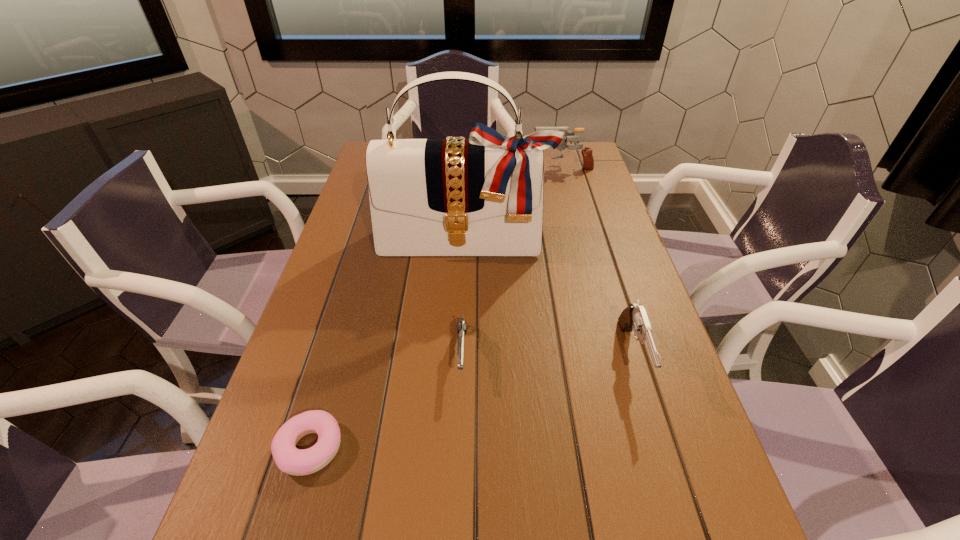
Locate an element on the screen. vacant space located 0.320m at the barrel end of the farthest object is located at coordinates (439, 166).

This screenshot has width=960, height=540. I want to click on vacant space located 0.170m at the barrel end of the farthest object, so click(483, 166).

The image size is (960, 540). I want to click on vacant region located at the barrel end of the farthest object, so click(433, 166).

Find the location of a particular element. Image resolution: width=960 pixels, height=540 pixels. vacant position located 0.220m at the muzzle of the second shortest gun is located at coordinates (684, 522).

This screenshot has width=960, height=540. Identify the location of free region located aiming along the barrel of the second shortest object. (460, 420).

You are a GUI agent. You are given a task and a screenshot of the screen. Output one action in this format:
    pyautogui.click(x=<x>, y=<y>)
    Task: Click on the vacant area situated on the back of the shortest object
    The image size is (960, 540).
    Given the screenshot: What is the action you would take?
    pyautogui.click(x=343, y=335)

Where is `object that is at the far edge`? object that is at the far edge is located at coordinates (588, 162).

The image size is (960, 540). In order to click on satchel that is positioned at the left edge in this screenshot , I will do 483,196.

At what (x,y) coordinates should I click in order to perform the action: click on pastry at the left edge. Please return your answer as a coordinate pair (x, y). This screenshot has height=540, width=960. Looking at the image, I should click on (289, 459).

The image size is (960, 540). In order to click on object positioned at the far right corner in this screenshot , I will do `click(588, 162)`.